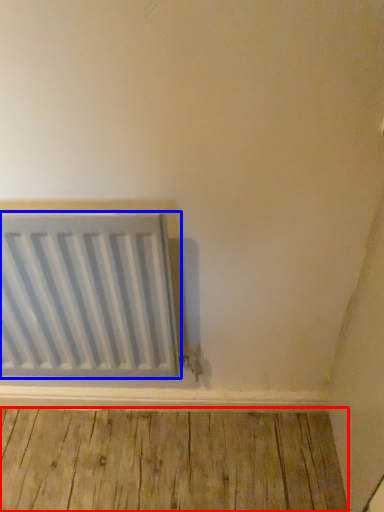
Question: Among these objects, which one is farthest to the camera, hardwood (highlighted by a red box) or radiator (highlighted by a blue box)?

Choices:
 (A) hardwood
 (B) radiator

Answer: (A)